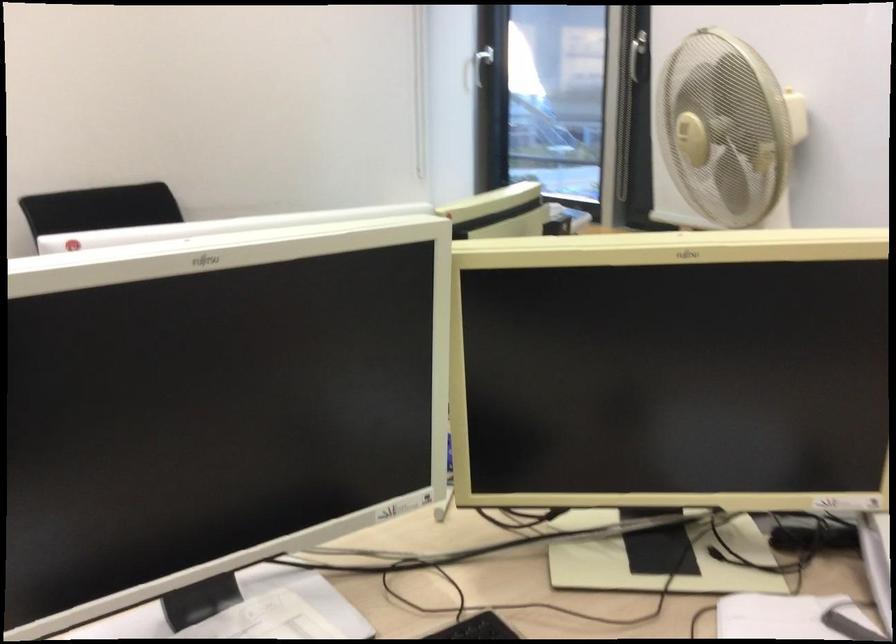
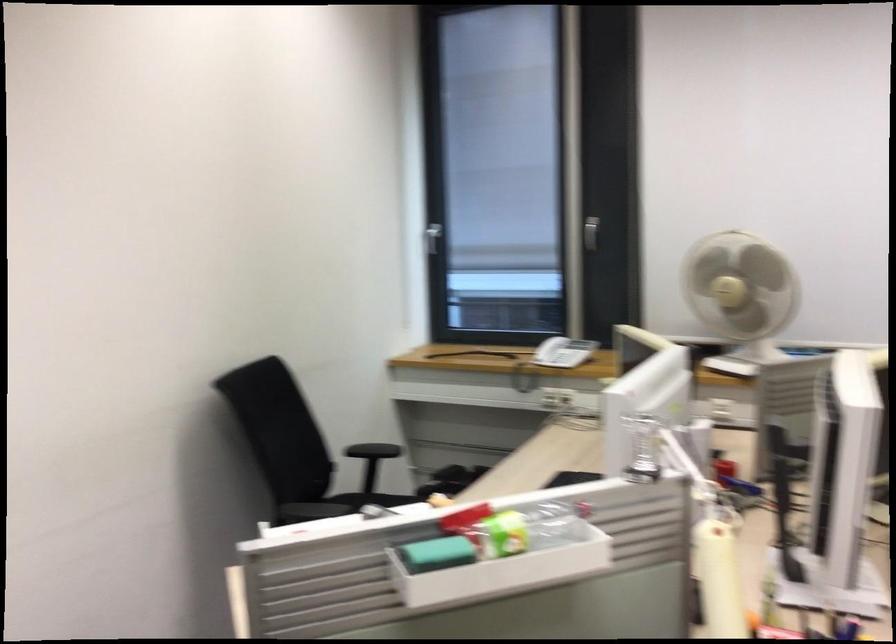
Where in the second image is the point corresponding to the point at 483,79 from the first image?

(433, 238)